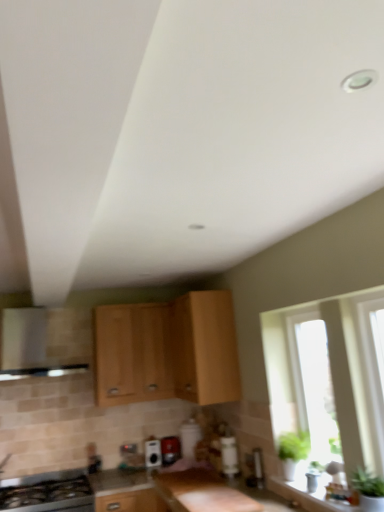
Question: Does light wood cabinet at center, marked as the first cabinetry in a right-to-left arrangement, turn towards transparent glass window at right?

Choices:
 (A) no
 (B) yes

Answer: (A)

Question: Does light wood cabinet at center, marked as the first cabinetry in a right-to-left arrangement, lie in front of transparent glass window at right?

Choices:
 (A) yes
 (B) no

Answer: (B)

Question: From a real-world perspective, is light wood cabinet at center, marked as the first cabinetry in a right-to-left arrangement, physically above transparent glass window at right?

Choices:
 (A) no
 (B) yes

Answer: (B)

Question: From a real-world perspective, is light wood cabinet at center, marked as the first cabinetry in a right-to-left arrangement, positioned under transparent glass window at right based on gravity?

Choices:
 (A) yes
 (B) no

Answer: (B)

Question: Is light wood cabinet at center, which is the third cabinetry from left to right, not within transparent glass window at right?

Choices:
 (A) no
 (B) yes

Answer: (B)

Question: In terms of width, does metallic silver toaster at center, which ranks as the first appliance in right-to-left order, look wider or thinner when compared to black glass stove at lower left?

Choices:
 (A) thin
 (B) wide

Answer: (A)

Question: Is metallic silver toaster at center, acting as the 2th appliance starting from the left, taller or shorter than black glass stove at lower left?

Choices:
 (A) short
 (B) tall

Answer: (A)

Question: In terms of size, does metallic silver toaster at center, acting as the 2th appliance starting from the left, appear bigger or smaller than black glass stove at lower left?

Choices:
 (A) small
 (B) big

Answer: (A)

Question: From the image's perspective, relative to black glass stove at lower left, is metallic silver toaster at center, which ranks as the first appliance in right-to-left order, above or below?

Choices:
 (A) below
 (B) above

Answer: (B)

Question: Is satin silver vent at left in front of or behind transparent glass window at right in the image?

Choices:
 (A) behind
 (B) front

Answer: (A)

Question: From their relative heights in the image, would you say satin silver vent at left is taller or shorter than transparent glass window at right?

Choices:
 (A) short
 (B) tall

Answer: (A)

Question: From a real-world perspective, is satin silver vent at left physically located above or below transparent glass window at right?

Choices:
 (A) above
 (B) below

Answer: (A)

Question: Considering the positions of satin silver vent at left and transparent glass window at right in the image, is satin silver vent at left wider or thinner than transparent glass window at right?

Choices:
 (A) wide
 (B) thin

Answer: (A)

Question: Considering the positions of smooth granite countertop at center and satin black toaster at center, positioned as the 2th appliance in right-to-left order, in the image, is smooth granite countertop at center bigger or smaller than satin black toaster at center, positioned as the 2th appliance in right-to-left order,?

Choices:
 (A) small
 (B) big

Answer: (B)

Question: Visually, is smooth granite countertop at center positioned to the left or to the right of satin black toaster at center, positioned as the 2th appliance in right-to-left order?

Choices:
 (A) right
 (B) left

Answer: (B)